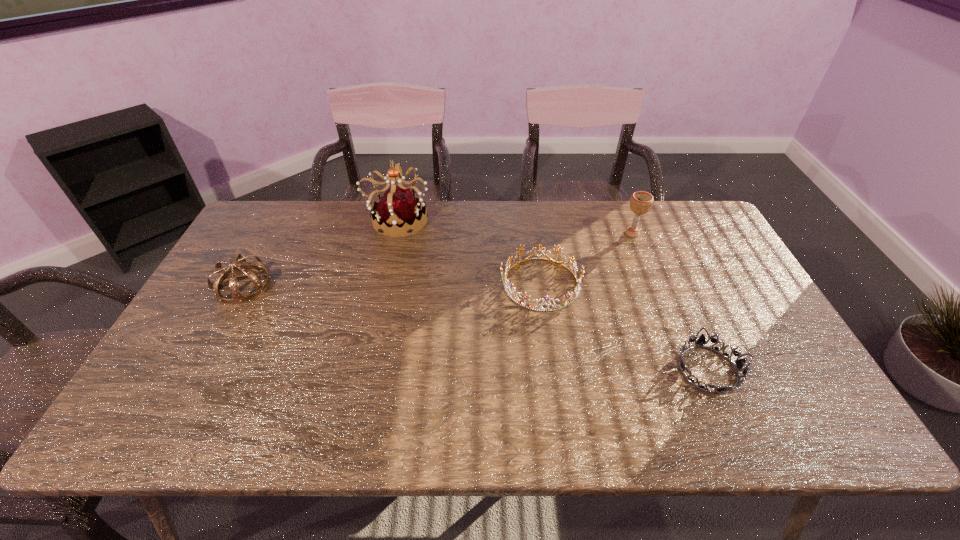
Identify which tiara is the second nearest to the fourth tallest object. Please provide its 2D coordinates. Your answer should be formatted as a tuple, i.e. [(x, y)], where the tuple contains the x and y coordinates of a point satisfying the conditions above.

[(398, 208)]

Locate an element on the screen. The image size is (960, 540). free space that satisfies the following two spatial constraints: 1. on the front-facing side of the tallest object; 2. on the left side of the chalice is located at coordinates point(395,233).

Identify the location of vacant space that satisfies the following two spatial constraints: 1. on the front-facing side of the second tallest object; 2. on the right side of the tallest tiara. The image size is (960, 540). (395, 233).

Where is `vacant space that satisfies the following two spatial constraints: 1. on the front-facing side of the second object from left to right; 2. on the front side of the leftmost tiara`? The image size is (960, 540). vacant space that satisfies the following two spatial constraints: 1. on the front-facing side of the second object from left to right; 2. on the front side of the leftmost tiara is located at coordinates (382, 285).

This screenshot has height=540, width=960. In order to click on free spot that satisfies the following two spatial constraints: 1. on the back side of the leftmost tiara; 2. on the left side of the fourth shortest object in this screenshot , I will do `click(272, 233)`.